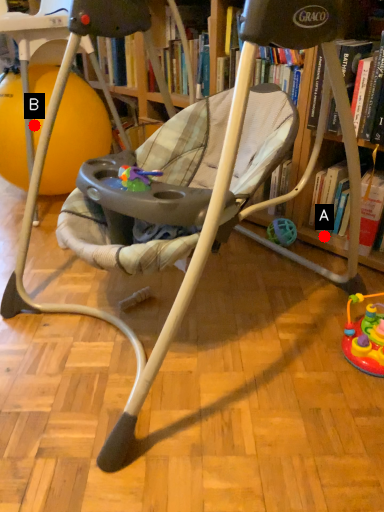
Question: Two points are circled on the image, labeled by A and B beside each circle. Which point is closer to the camera taking this photo?

Choices:
 (A) A is closer
 (B) B is closer

Answer: (A)